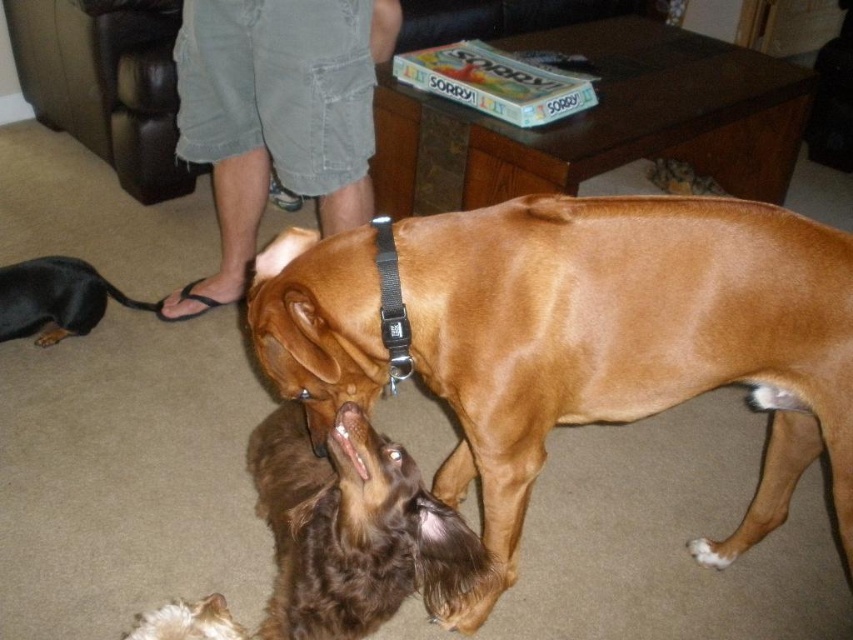
Is brown silky dog at center positioned before black leather leash at lower left?

Yes, it is.

Which is behind, point (335, 524) or point (12, 316)?

Point (12, 316)

Locate an element on the screen. The width and height of the screenshot is (853, 640). brown silky dog at center is located at coordinates pos(351,529).

Is point (817, 252) closer to camera compared to point (252, 131)?

That is True.

In order to click on brown shiny dog at center in this screenshot , I will do `click(625, 340)`.

Describe the element at coordinates (625, 340) in the screenshot. The height and width of the screenshot is (640, 853). I see `brown shiny dog at center` at that location.

Is brown shiny dog at center bigger than brown silky dog at center?

Yes.

Is point (520, 492) less distant than point (341, 426)?

That is False.

Identify the location of brown shiny dog at center. (625, 340).